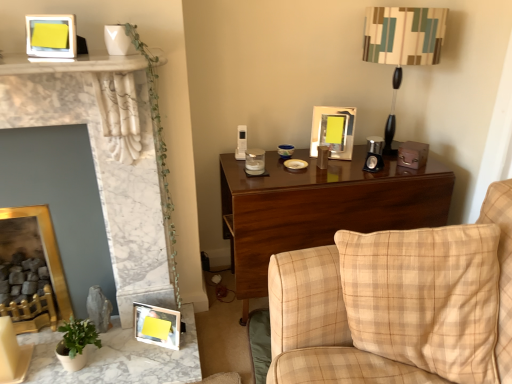
Locate an element on the screen. The width and height of the screenshot is (512, 384). vacant area situated below green matte plant at lower left (from a real-world perspective) is located at coordinates (89, 361).